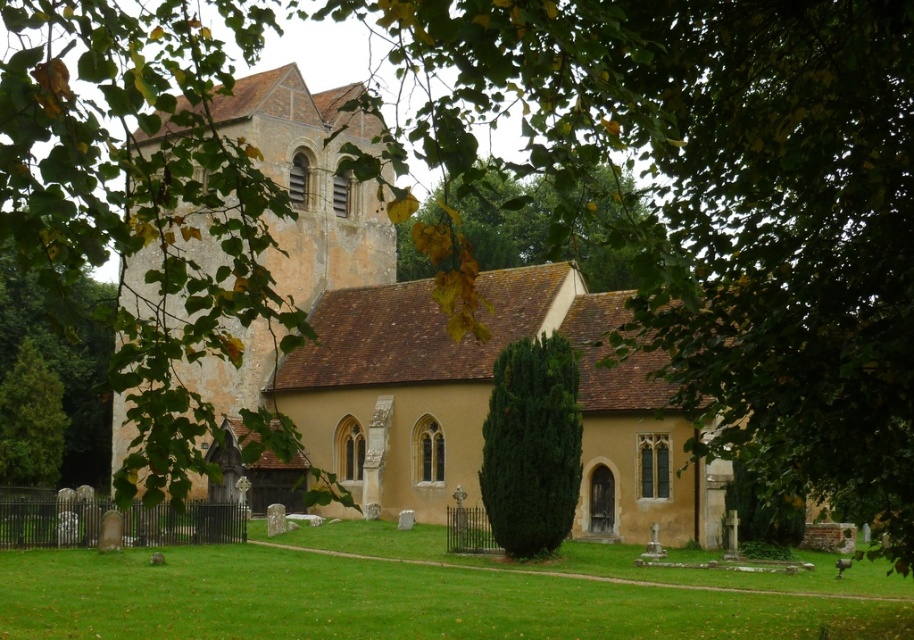
Measure the distance from yellow stone church at center to green leafy tree at center.

17.32 meters

Who is taller, yellow stone church at center or green leafy tree at center?

Standing taller between the two is yellow stone church at center.

Who is more forward, (479, 387) or (399, 248)?

Point (479, 387)

This screenshot has width=914, height=640. In order to click on yellow stone church at center in this screenshot , I will do `click(432, 348)`.

Between yellow stone church at center and green leafy tree at upper left, which one is positioned higher?

yellow stone church at center is higher up.

Who is positioned more to the left, yellow stone church at center or green leafy tree at upper left?

Positioned to the left is green leafy tree at upper left.

What do you see at coordinates (432, 348) in the screenshot?
I see `yellow stone church at center` at bounding box center [432, 348].

Locate an element on the screen. This screenshot has width=914, height=640. yellow stone church at center is located at coordinates click(432, 348).

Which of these two, green textured bush at center or green leafy tree at upper left, stands shorter?

Standing shorter between the two is green textured bush at center.

The image size is (914, 640). Find the location of `green textured bush at center`. green textured bush at center is located at coordinates (530, 445).

Is point (564, 497) behind point (92, 438)?

No, it is in front of (92, 438).

In order to click on green textured bush at center in this screenshot , I will do `click(530, 445)`.